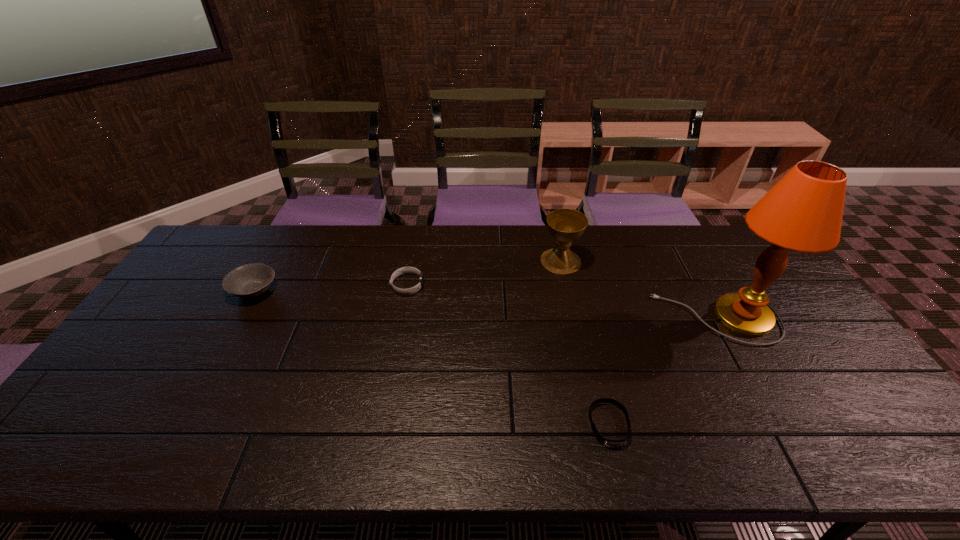
At what (x,y) coordinates should I click in order to perform the action: click on object that is the nearest to the leftmost object. Please return your answer as a coordinate pair (x, y). The height and width of the screenshot is (540, 960). Looking at the image, I should click on (409, 291).

Locate an element on the screen. object that is the second closest to the chalice is located at coordinates (409, 291).

Identify the location of free spot that satisfies the following two spatial constraints: 1. on the front side of the fourth shortest object; 2. on the outer surface of the fourth tallest object. (566, 285).

At what (x,y) coordinates should I click in order to perform the action: click on free space that satisfies the following two spatial constraints: 1. on the outer surface of the rightmost object; 2. on the right side of the fourth tallest object. Please return your answer as a coordinate pair (x, y). Image resolution: width=960 pixels, height=540 pixels. Looking at the image, I should click on (401, 318).

Identify the location of free spot that satisfies the following two spatial constraints: 1. on the front side of the fourth shortest object; 2. on the outer surface of the second object from left to right. (566, 285).

This screenshot has width=960, height=540. I want to click on blank space that satisfies the following two spatial constraints: 1. on the front side of the chalice; 2. on the right side of the tallest object, so click(573, 318).

Identify the location of vacant space that satisfies the following two spatial constraints: 1. on the back side of the lamp; 2. on the outer surface of the farther wristband. (700, 285).